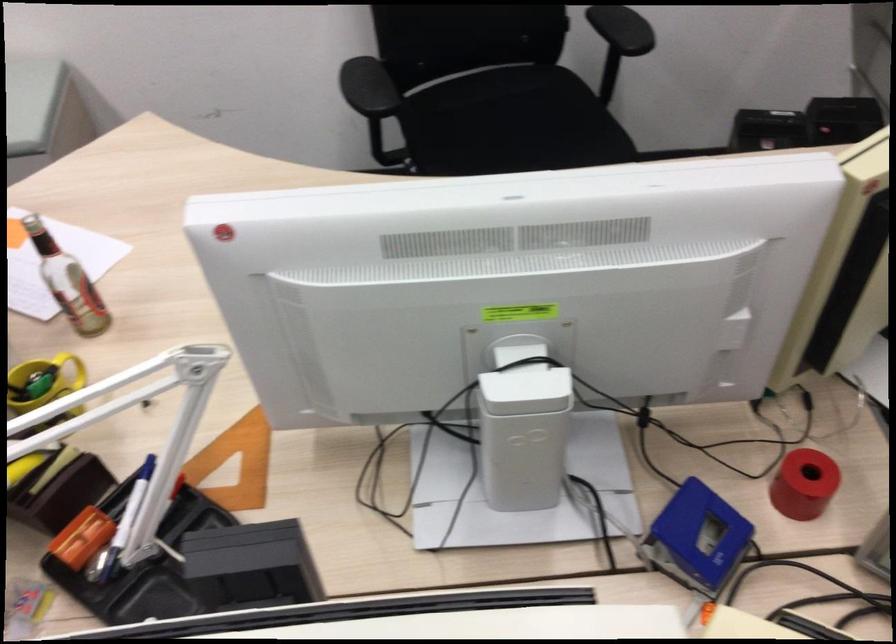
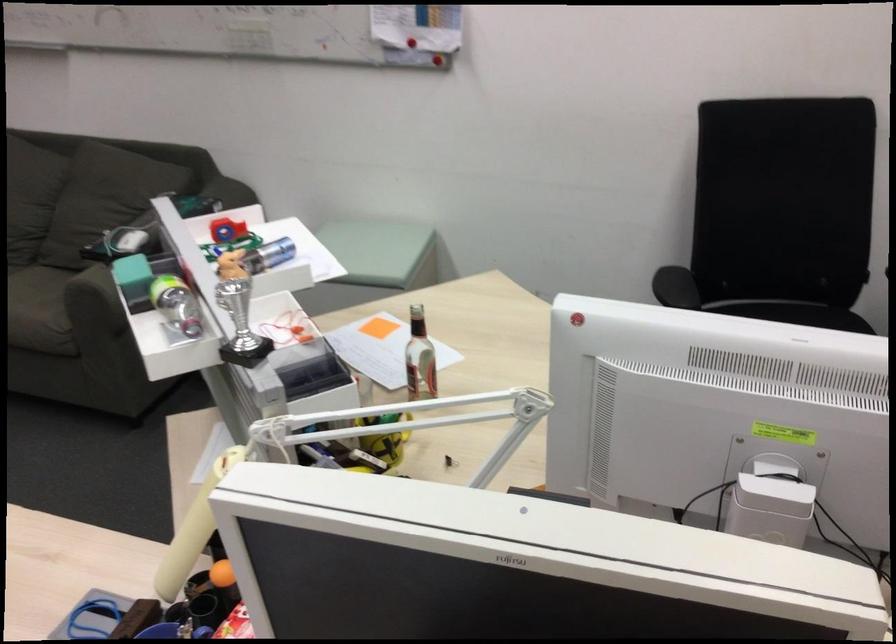
Find the pixel in the second image that matches (529,412) in the first image.

(770, 509)